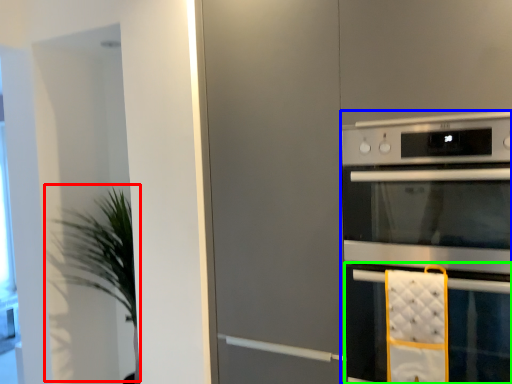
Question: Based on their relative distances, which object is nearer to plant (highlighted by a red box)? Choose from home appliance (highlighted by a blue box) and oven (highlighted by a green box).

Choices:
 (A) home appliance
 (B) oven

Answer: (A)